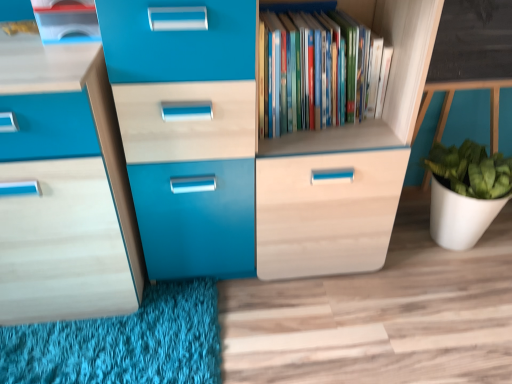
Question: Considering their positions, is wooden bookshelf at center located in front of or behind matte plastic container at upper left?

Choices:
 (A) behind
 (B) front

Answer: (A)

Question: Is point click(x=374, y=26) closer or farther from the camera than point click(x=58, y=1)?

Choices:
 (A) closer
 (B) farther

Answer: (B)

Question: From a real-world perspective, relative to matte plastic container at upper left, is wooden bookshelf at center vertically above or below?

Choices:
 (A) above
 (B) below

Answer: (B)

Question: In the image, is matte plastic container at upper left on the left side or the right side of wooden bookshelf at center?

Choices:
 (A) left
 (B) right

Answer: (A)

Question: Is matte plastic container at upper left inside the boundaries of wooden bookshelf at center, or outside?

Choices:
 (A) inside
 (B) outside

Answer: (B)

Question: In terms of width, does matte plastic container at upper left look wider or thinner when compared to wooden bookshelf at center?

Choices:
 (A) thin
 (B) wide

Answer: (B)

Question: From a real-world perspective, is matte plastic container at upper left physically located above or below wooden bookshelf at center?

Choices:
 (A) above
 (B) below

Answer: (A)